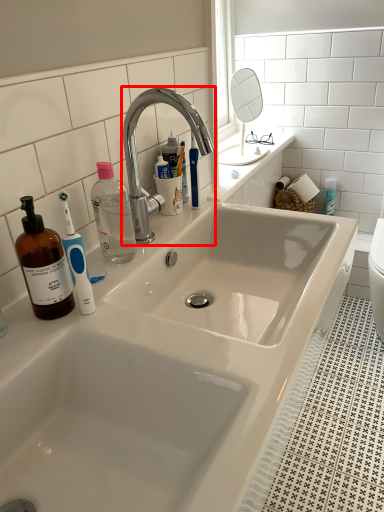
Question: Observing the image, what is the correct spatial positioning of tap (annotated by the red box) in reference to mirror?

Choices:
 (A) right
 (B) left

Answer: (B)